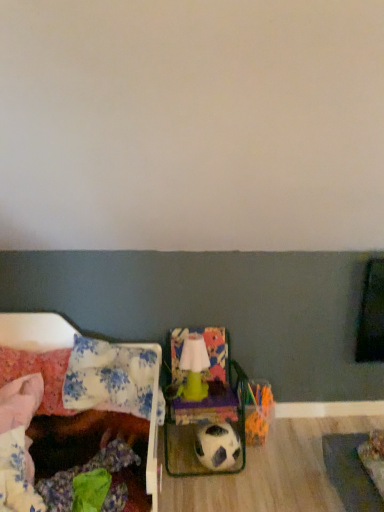
The image size is (384, 512). Identify the location of free space on the front side of black and white textured football at center. (226, 495).